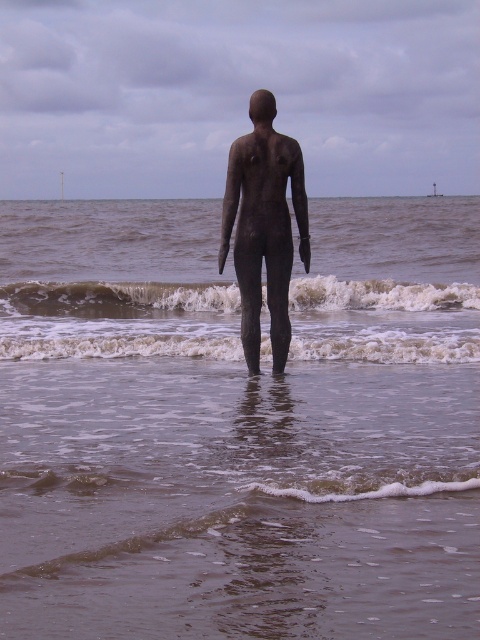
You are a photographer trying to capture the sculpture in the water. You want to ensure the brown textured water at center and white foamy wave at center are both visible in your shot. Which object should you focus on to include both in the frame?

The brown textured water at center is above the white foamy wave at center, so focusing on the brown textured water at center will ensure both are visible in the frame.